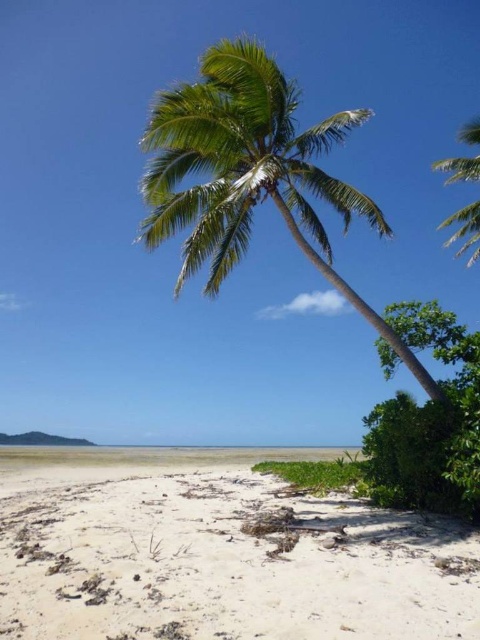
Question: Is green leafy palm tree at center positioned behind green leafy palm tree at upper right?

Choices:
 (A) yes
 (B) no

Answer: (B)

Question: Which point is closer to the camera?

Choices:
 (A) (456, 236)
 (B) (186, 248)
 (C) (105, 579)

Answer: (C)

Question: Is green leafy palm tree at center wider than green leafy palm tree at upper right?

Choices:
 (A) yes
 (B) no

Answer: (B)

Question: Can you confirm if green leafy palm tree at center is thinner than green leafy palm tree at upper right?

Choices:
 (A) yes
 (B) no

Answer: (A)

Question: Which is farther from the green leafy palm tree at center?

Choices:
 (A) green leafy palm tree at upper right
 (B) white sandy beach at lower center

Answer: (A)

Question: Which point is farther from the camera taking this photo?

Choices:
 (A) (456, 584)
 (B) (243, 54)

Answer: (B)